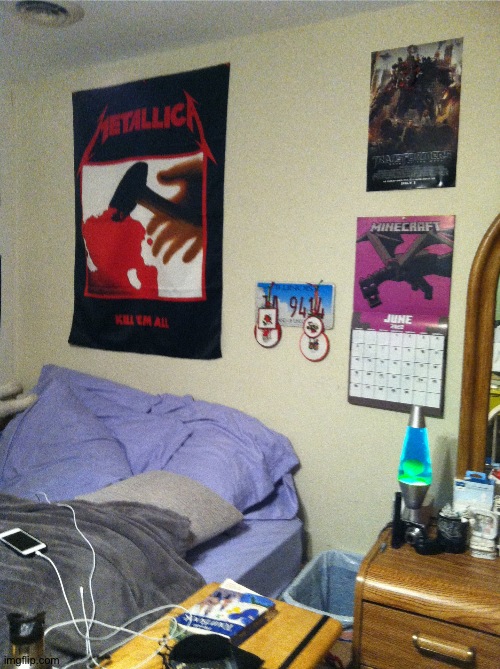
The height and width of the screenshot is (669, 500). What are the coordinates of `phone` in the screenshot? It's located at (22, 554).